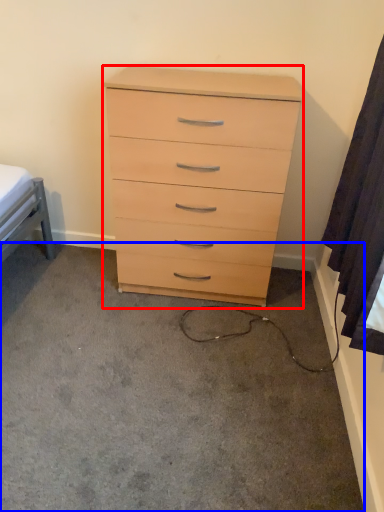
Question: Among these objects, which one is nearest to the camera, chest of drawers (highlighted by a red box) or concrete (highlighted by a blue box)?

Choices:
 (A) chest of drawers
 (B) concrete

Answer: (B)